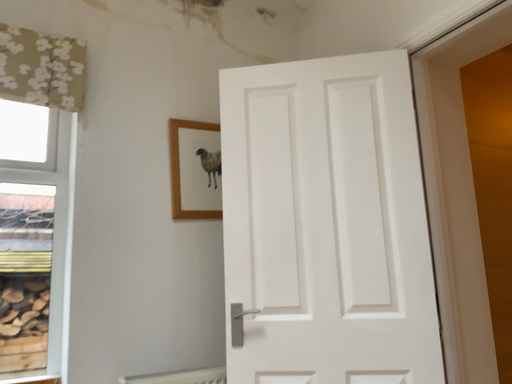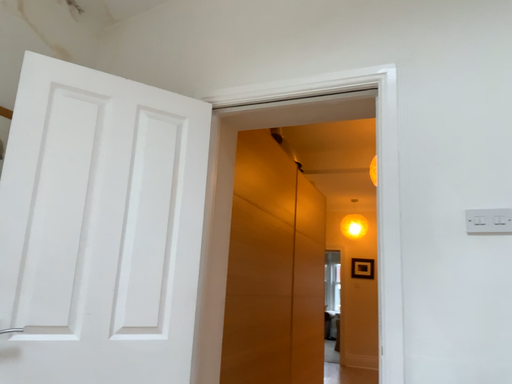
Question: How did the camera likely rotate when shooting the video?

Choices:
 (A) rotated right
 (B) rotated left

Answer: (A)